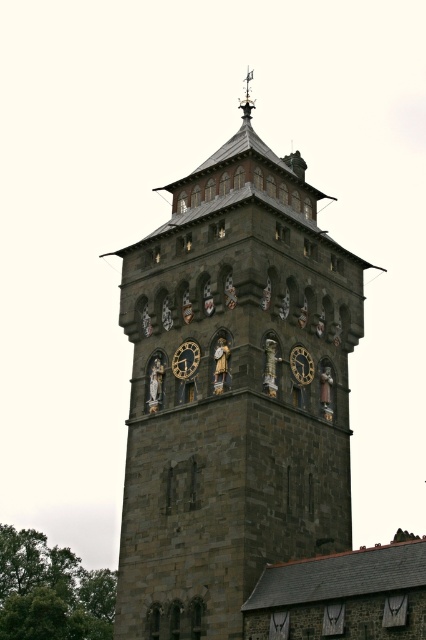
Question: Which of the following is the closest to the observer?

Choices:
 (A) gold/brass weather vane at top
 (B) dark brown stone clock at center
 (C) dark stone clock tower at center

Answer: (C)

Question: From the image, what is the correct spatial relationship of dark brown stone clock at center in relation to gold metallic clock at center?

Choices:
 (A) right
 (B) left

Answer: (B)

Question: In this image, where is dark stone clock tower at center located relative to gold metallic clock at center?

Choices:
 (A) left
 (B) right

Answer: (A)

Question: Based on their relative distances, which object is nearer to the gold metallic clock at center?

Choices:
 (A) dark brown stone clock at center
 (B) gold/brass weather vane at top
 (C) dark stone clock tower at center

Answer: (A)

Question: Is dark brown stone clock at center smaller than gold metallic clock at center?

Choices:
 (A) no
 (B) yes

Answer: (B)

Question: Which point is closer to the camera?

Choices:
 (A) gold/brass weather vane at top
 (B) gold metallic clock at center
 (C) dark brown stone clock at center
 (D) dark stone clock tower at center

Answer: (D)